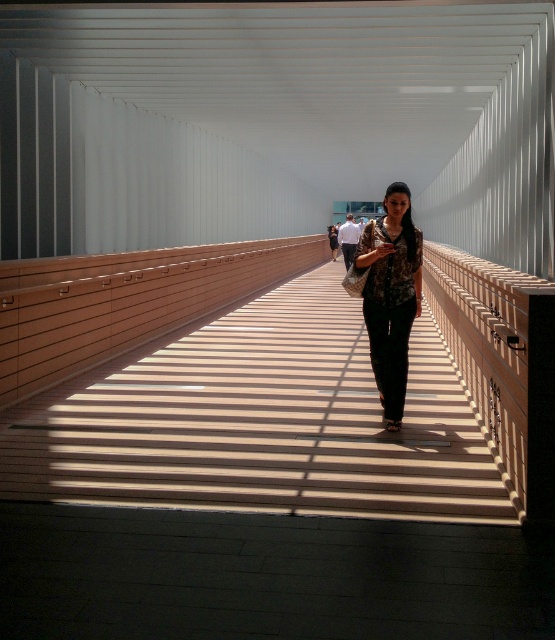
You are standing on the wooden bridge at center and looking down at the floral fabric dress at center. Which object appears closer to the ground?

The floral fabric dress at center is taller than the wooden bridge at center, so the wooden bridge at center appears closer to the ground.

You are standing on the wooden floor of the pedestrian bridge and notice a specific point marked at coordinates (260, 420). According to the scene description, what object is located at that point?

The point at (260, 420) indicates the wooden bridge at center.

From the picture: You are standing on the wooden bridge at center and looking towards the floral fabric dress at center. According to the scene description, which object is closer to you?

The wooden bridge at center is closer to you because it is in front of the floral fabric dress at center.